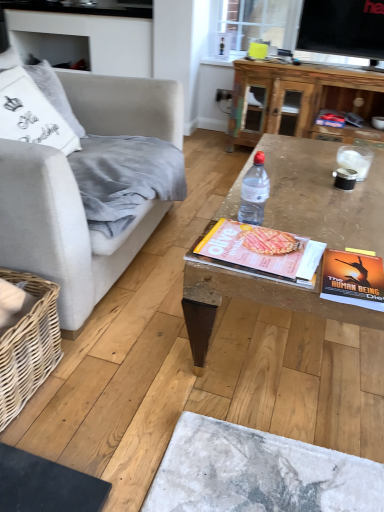
Question: From the image's perspective, is wooden coffee table at upper center located beneath matte yellow magazine at center?

Choices:
 (A) yes
 (B) no

Answer: (B)

Question: Considering the relative sizes of wooden coffee table at upper center and matte yellow magazine at center in the image provided, is wooden coffee table at upper center bigger than matte yellow magazine at center?

Choices:
 (A) yes
 (B) no

Answer: (A)

Question: Is wooden coffee table at upper center directly adjacent to matte yellow magazine at center?

Choices:
 (A) no
 (B) yes

Answer: (A)

Question: Can you confirm if wooden coffee table at upper center is positioned to the left of matte yellow magazine at center?

Choices:
 (A) yes
 (B) no

Answer: (B)

Question: From a real-world perspective, does wooden coffee table at upper center stand above matte yellow magazine at center?

Choices:
 (A) yes
 (B) no

Answer: (B)

Question: Is the depth of wooden coffee table at upper center greater than that of matte yellow magazine at center?

Choices:
 (A) yes
 (B) no

Answer: (A)

Question: From a real-world perspective, is clear plastic bottle at center below matte yellow magazine at center?

Choices:
 (A) yes
 (B) no

Answer: (B)

Question: Can you confirm if clear plastic bottle at center is thinner than matte yellow magazine at center?

Choices:
 (A) no
 (B) yes

Answer: (B)

Question: Does clear plastic bottle at center have a greater height compared to matte yellow magazine at center?

Choices:
 (A) no
 (B) yes

Answer: (B)

Question: Considering the relative sizes of clear plastic bottle at center and matte yellow magazine at center in the image provided, is clear plastic bottle at center bigger than matte yellow magazine at center?

Choices:
 (A) no
 (B) yes

Answer: (A)

Question: Does clear plastic bottle at center contain matte yellow magazine at center?

Choices:
 (A) yes
 (B) no

Answer: (B)

Question: From a real-world perspective, is clear plastic bottle at center over matte yellow magazine at center?

Choices:
 (A) no
 (B) yes

Answer: (B)

Question: Is wooden coffee table at center completely or partially outside of wooden coffee table at upper center?

Choices:
 (A) yes
 (B) no

Answer: (A)